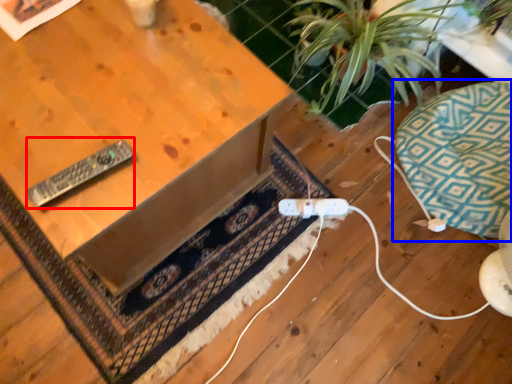
Question: Among these objects, which one is nearest to the camera, remote (highlighted by a red box) or swivel chair (highlighted by a blue box)?

Choices:
 (A) remote
 (B) swivel chair

Answer: (A)